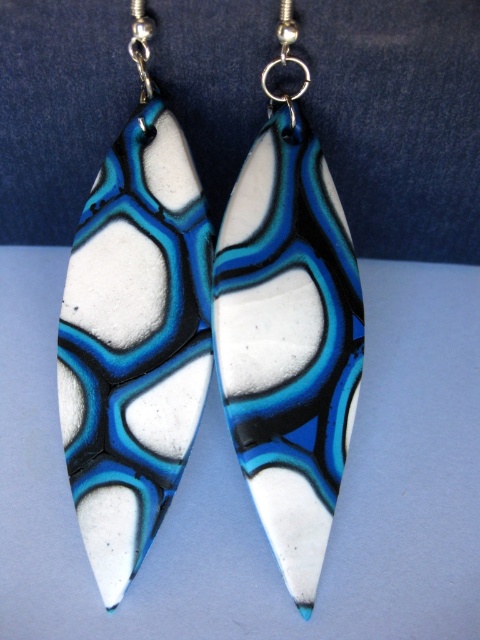
Question: Can you confirm if matte polymer clay earring at left is positioned to the left of matte polymer clay earring at center?

Choices:
 (A) no
 (B) yes

Answer: (B)

Question: Which object is farther from the camera taking this photo?

Choices:
 (A) matte polymer clay earring at center
 (B) matte polymer clay earring at left

Answer: (B)

Question: Is matte polymer clay earring at left positioned at the back of matte polymer clay earring at center?

Choices:
 (A) yes
 (B) no

Answer: (A)

Question: Which point is farther to the camera?

Choices:
 (A) matte polymer clay earring at center
 (B) matte polymer clay earring at left

Answer: (B)

Question: Is matte polymer clay earring at left below matte polymer clay earring at center?

Choices:
 (A) no
 (B) yes

Answer: (A)

Question: Which point appears closest to the camera in this image?

Choices:
 (A) (261, 280)
 (B) (178, 456)

Answer: (B)